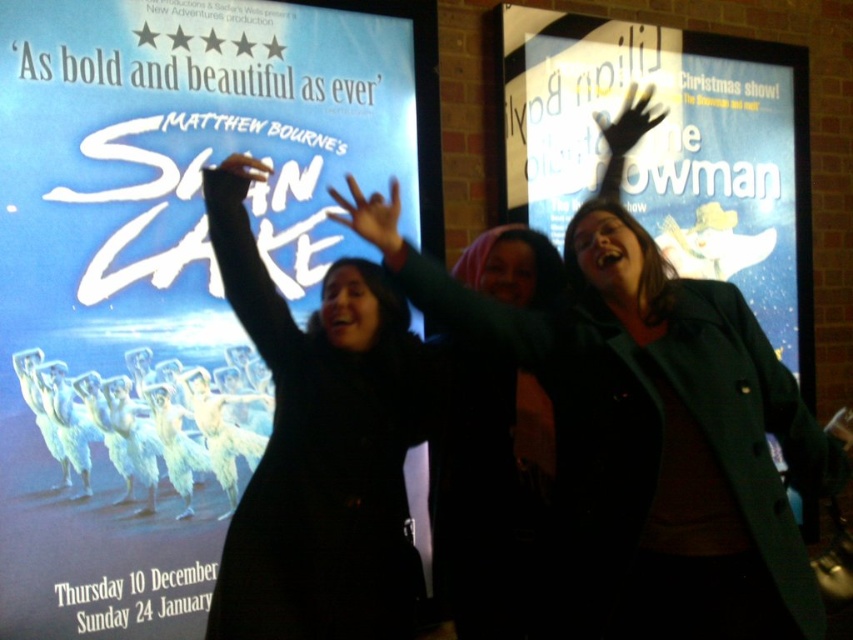
Between teal fabric coat at center and matte black hand at upper center, which one appears on the left side from the viewer's perspective?

Positioned to the left is matte black hand at upper center.

Which of these two, teal fabric coat at center or matte black hand at upper center, stands taller?

Standing taller between the two is teal fabric coat at center.

What are the coordinates of `teal fabric coat at center` in the screenshot? It's located at coord(663,435).

Does transparent glass hand at upper center have a lesser height compared to black matte phone at upper left?

No, transparent glass hand at upper center is not shorter than black matte phone at upper left.

Which is more to the right, transparent glass hand at upper center or black matte phone at upper left?

Positioned to the right is transparent glass hand at upper center.

You are a GUI agent. You are given a task and a screenshot of the screen. Output one action in this format:
    pyautogui.click(x=<x>, y=<y>)
    Task: Click on the transparent glass hand at upper center
    The height and width of the screenshot is (640, 853).
    Given the screenshot: What is the action you would take?
    pyautogui.click(x=628, y=122)

Locate an element on the screen. transparent glass hand at upper center is located at coordinates (628, 122).

Consider the image. Does matte black poster at left have a greater width compared to black matte coat at center?

Correct, the width of matte black poster at left exceeds that of black matte coat at center.

Between matte black poster at left and black matte coat at center, which one is positioned lower?

Positioned lower is black matte coat at center.

Between point (102, 152) and point (219, 586), which one is positioned behind?

Point (102, 152)

This screenshot has height=640, width=853. I want to click on matte black poster at left, so click(167, 273).